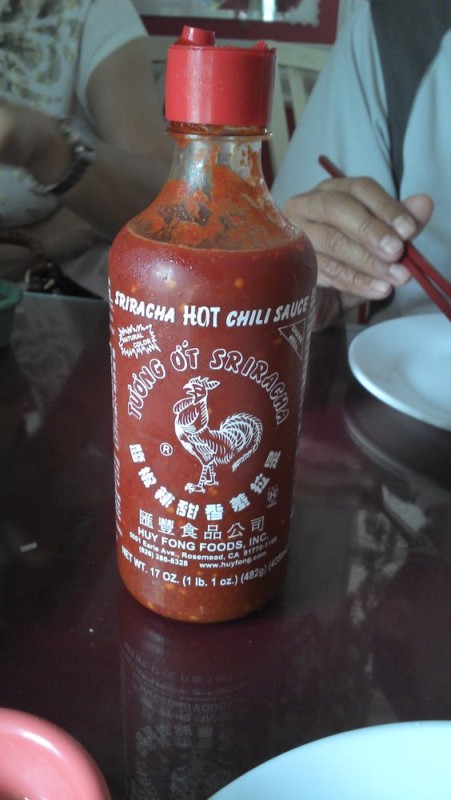
Where is `plates`? The height and width of the screenshot is (800, 451). plates is located at coordinates (314, 758), (32, 752), (410, 382).